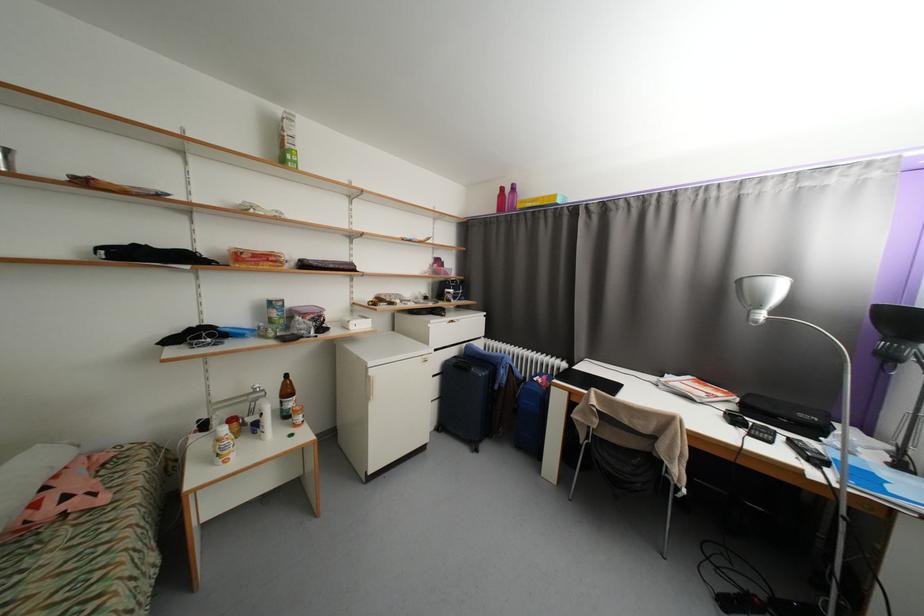
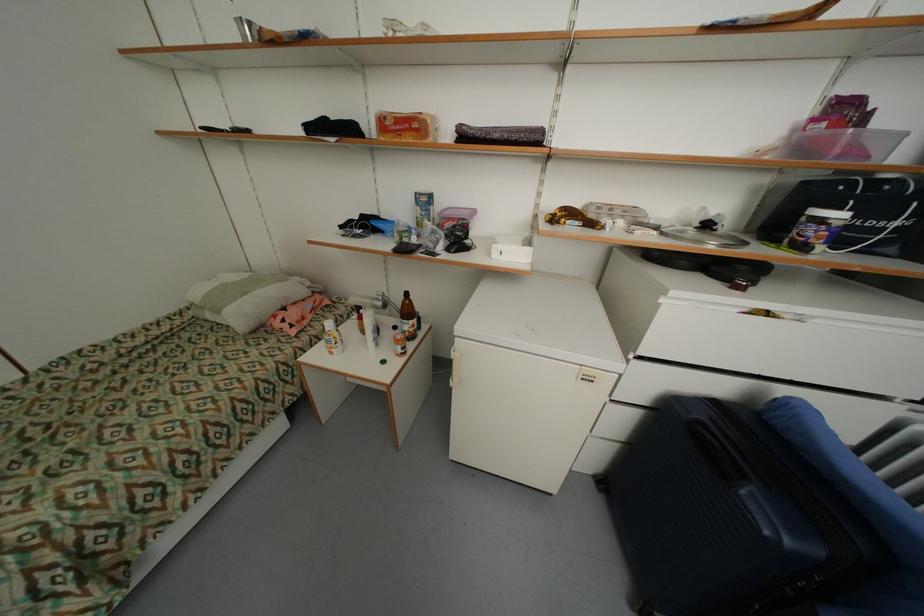
In the second image, find the point that corresponds to point 432,299 in the first image.

(713, 227)